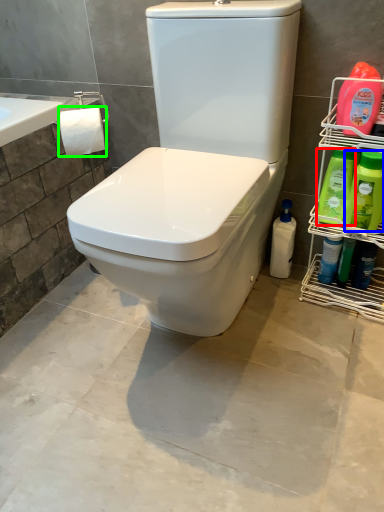
Question: Based on their relative distances, which object is nearer to cleaning product (highlighted by a red box)? Choose from cleaning product (highlighted by a blue box) and toilet paper (highlighted by a green box).

Choices:
 (A) cleaning product
 (B) toilet paper

Answer: (A)